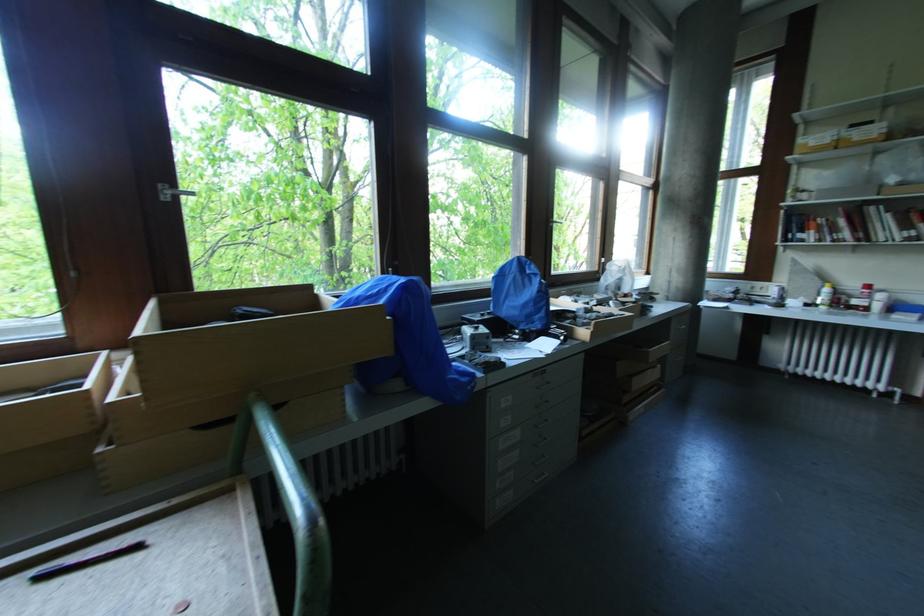
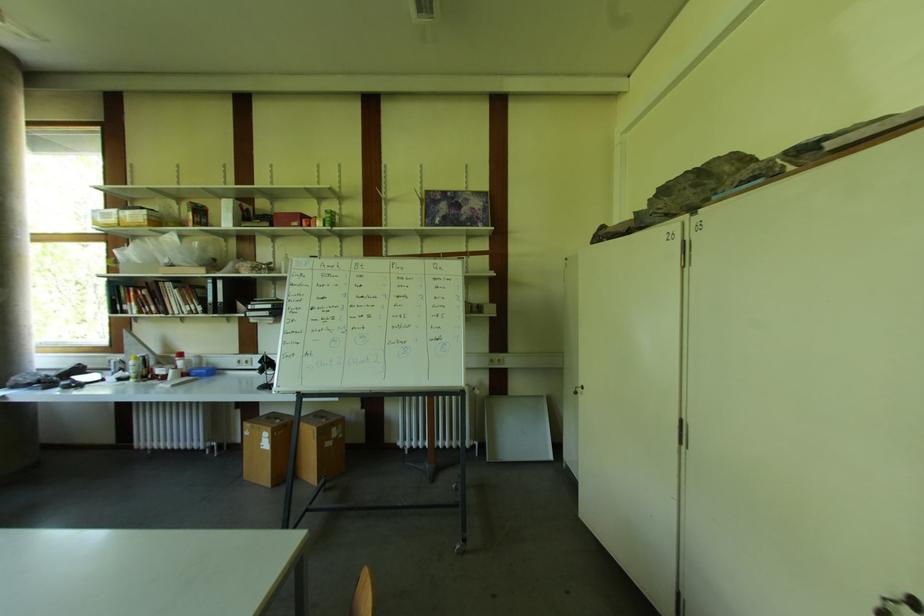
In the second image, find the point that corresponds to point (871, 288) in the first image.

(184, 357)